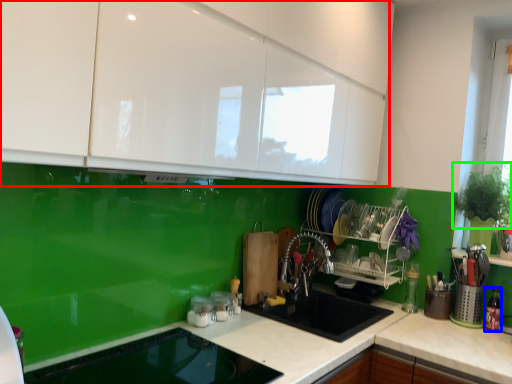
Question: Based on their relative distances, which object is farther from cabinetry (highlighted by a red box)? Choose from appliance (highlighted by a blue box) and plant (highlighted by a green box).

Choices:
 (A) appliance
 (B) plant

Answer: (A)